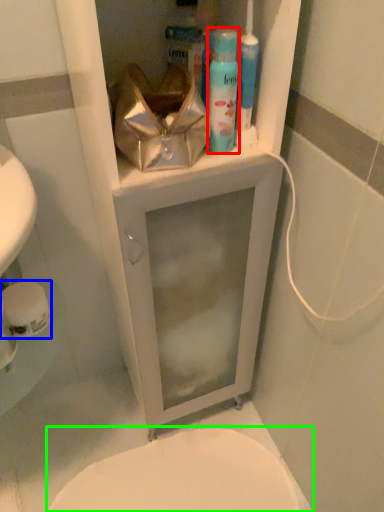
Question: Which is nearer to the shaving cream (highlighted by a red box)? toilet paper (highlighted by a blue box) or bidet (highlighted by a green box).

Choices:
 (A) toilet paper
 (B) bidet

Answer: (A)